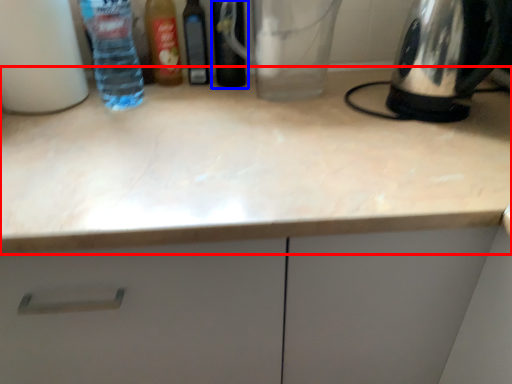
Question: Which of the following is the closest to the observer, countertop (highlighted by a red box) or bottle (highlighted by a blue box)?

Choices:
 (A) countertop
 (B) bottle

Answer: (A)